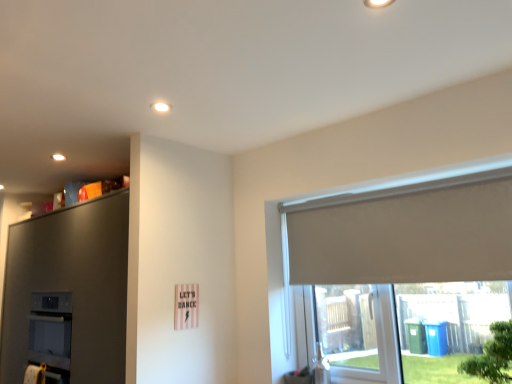
Question: From a real-world perspective, is green leafy tree at lower right physically above white roller blind at right?

Choices:
 (A) yes
 (B) no

Answer: (B)

Question: Is green leafy tree at lower right wider than white roller blind at right?

Choices:
 (A) yes
 (B) no

Answer: (A)

Question: Can you confirm if green leafy tree at lower right is taller than white roller blind at right?

Choices:
 (A) no
 (B) yes

Answer: (A)

Question: Does green leafy tree at lower right have a smaller size compared to white roller blind at right?

Choices:
 (A) no
 (B) yes

Answer: (B)

Question: Is green leafy tree at lower right not inside white roller blind at right?

Choices:
 (A) yes
 (B) no

Answer: (A)

Question: Based on their sizes in the image, would you say white roller blind at right is bigger or smaller than green leafy tree at lower right?

Choices:
 (A) small
 (B) big

Answer: (B)

Question: Is point (468, 241) closer or farther from the camera than point (497, 375)?

Choices:
 (A) farther
 (B) closer

Answer: (A)

Question: From a real-world perspective, relative to green leafy tree at lower right, is white roller blind at right vertically above or below?

Choices:
 (A) below
 (B) above

Answer: (B)

Question: From their relative heights in the image, would you say white roller blind at right is taller or shorter than green leafy tree at lower right?

Choices:
 (A) tall
 (B) short

Answer: (A)

Question: From their relative heights in the image, would you say matte gray dresser at upper left is taller or shorter than white roller blind at right?

Choices:
 (A) tall
 (B) short

Answer: (A)

Question: From the image's perspective, is matte gray dresser at upper left located above or below white roller blind at right?

Choices:
 (A) below
 (B) above

Answer: (A)

Question: Choose the correct answer: Is matte gray dresser at upper left inside white roller blind at right or outside it?

Choices:
 (A) outside
 (B) inside

Answer: (A)

Question: Looking at the image, does matte gray dresser at upper left seem bigger or smaller compared to white roller blind at right?

Choices:
 (A) small
 (B) big

Answer: (B)

Question: From the image's perspective, relative to matte gray dresser at upper left, is green leafy tree at lower right above or below?

Choices:
 (A) above
 (B) below

Answer: (A)

Question: Visually, is green leafy tree at lower right positioned to the left or to the right of matte gray dresser at upper left?

Choices:
 (A) left
 (B) right

Answer: (B)